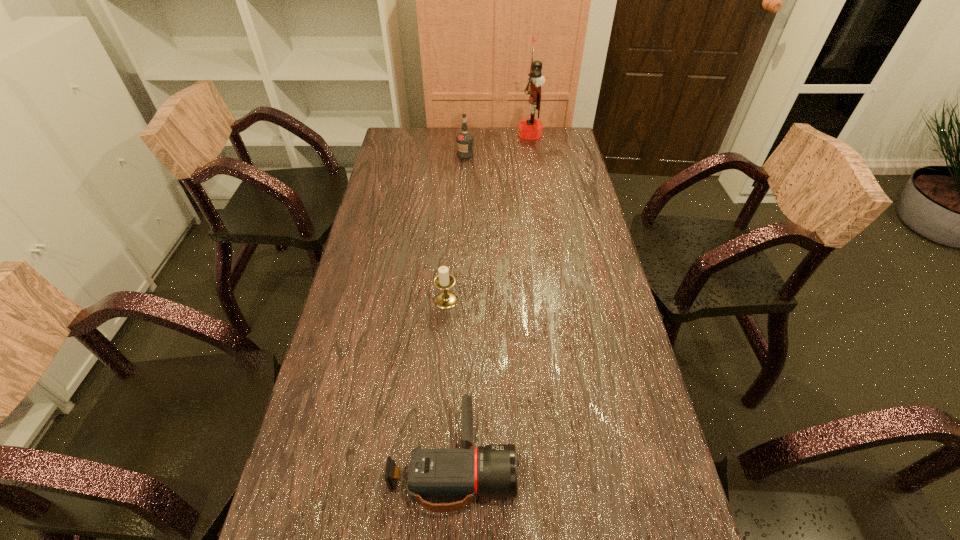
Locate an element on the screen. empty location between the vodka and the farthest object is located at coordinates (497, 144).

Choose which object is the third nearest neighbor to the farthest object. Please provide its 2D coordinates. Your answer should be formatted as a tuple, i.e. [(x, y)], where the tuple contains the x and y coordinates of a point satisfying the conditions above.

[(434, 474)]

At what (x,y) coordinates should I click in order to perform the action: click on object that ranks as the third closest to the camcorder. Please return your answer as a coordinate pair (x, y). This screenshot has height=540, width=960. Looking at the image, I should click on (530, 129).

Find the location of `free space that satisfies the following two spatial constraints: 1. on the front-facing side of the rightmost object; 2. on the front label of the second farthest object`. free space that satisfies the following two spatial constraints: 1. on the front-facing side of the rightmost object; 2. on the front label of the second farthest object is located at coordinates (533, 154).